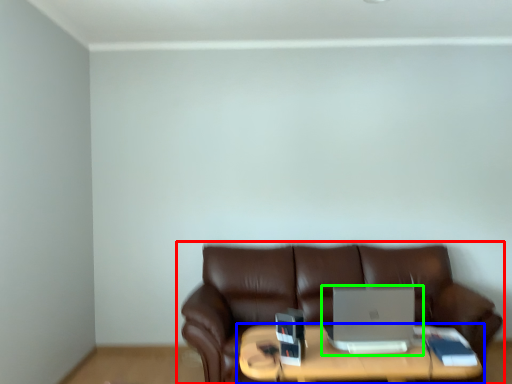
Question: Which is nearer to the studio couch (highlighted by a red box)? table (highlighted by a blue box) or laptop (highlighted by a green box).

Choices:
 (A) table
 (B) laptop

Answer: (A)